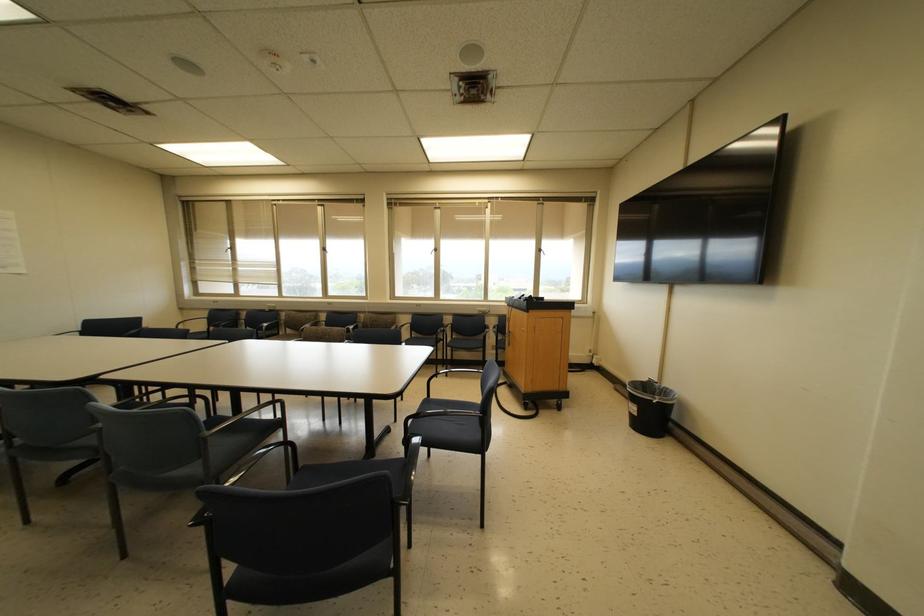
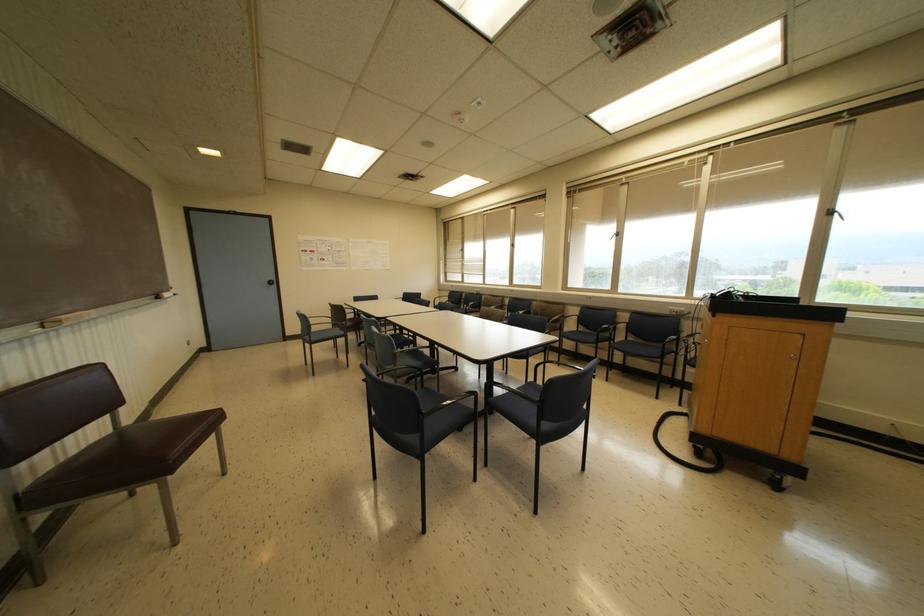
The point at (x=204, y=438) is marked in the first image. Where is the corresponding point in the second image?

(394, 354)